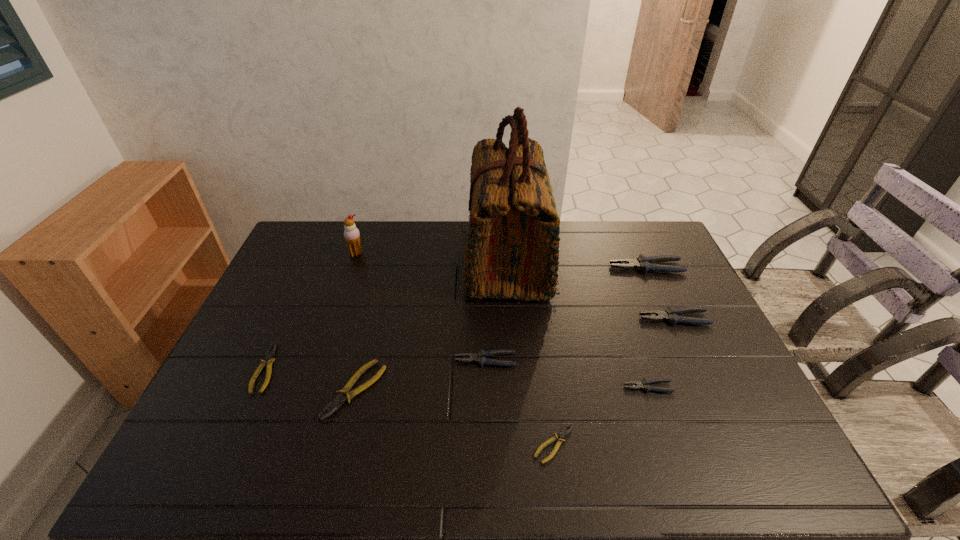
Choose which gray pliers is the second nearest neighbor to the fifth shortest pliers. Please provide its 2D coordinates. Your answer should be formatted as a tuple, i.e. [(x, y)], where the tuple contains the x and y coordinates of a point satisfying the conditions above.

[(670, 314)]

At what (x,y) coordinates should I click in order to perform the action: click on the second closest yellow pliers relative to the nearest pliers. Please return your answer as a coordinate pair (x, y). Looking at the image, I should click on (268, 359).

This screenshot has width=960, height=540. Find the location of `the second closest yellow pliers relative to the second smallest gray pliers`. the second closest yellow pliers relative to the second smallest gray pliers is located at coordinates (343, 395).

Identify the location of free spot that satisfies the following two spatial constraints: 1. at the front with a straw on the second object from left to right; 2. on the left side of the second yellow pliers from left to right. This screenshot has height=540, width=960. (309, 390).

Locate an element on the screen. vacant area that satisfies the following two spatial constraints: 1. on the open handle side of the shortest pliers; 2. on the right side of the shopping bag is located at coordinates (522, 444).